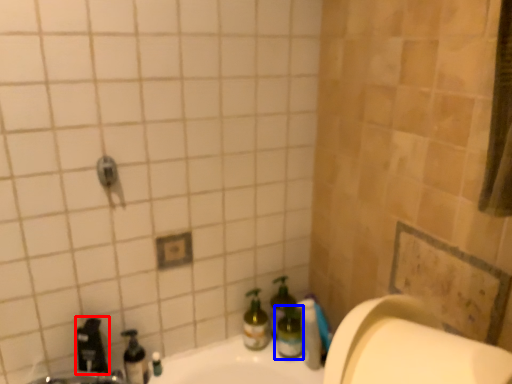
Question: Which point is closer to the camera, faucet (highlighted by a red box) or bottle (highlighted by a blue box)?

Choices:
 (A) faucet
 (B) bottle

Answer: (A)